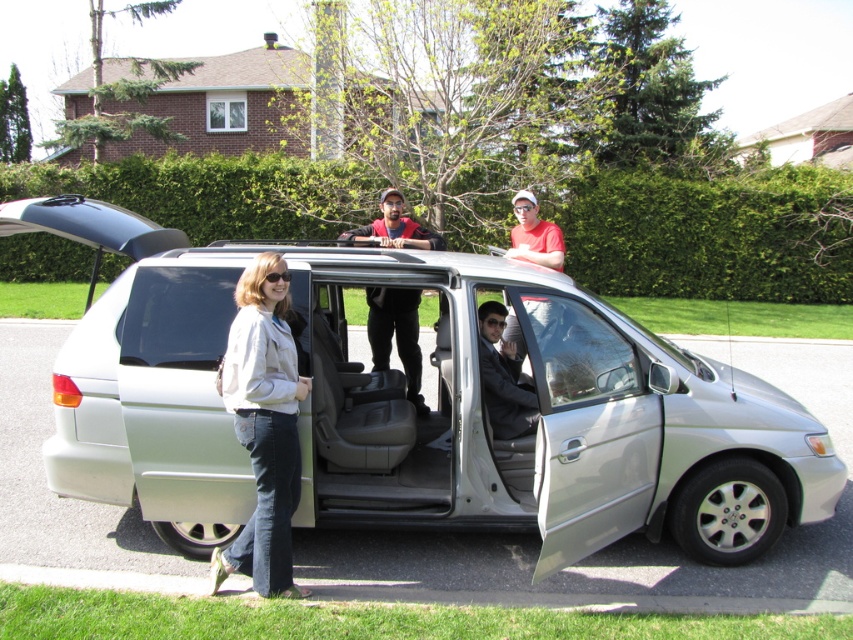
Question: Estimate the real-world distances between objects in this image. Which object is farther from the silver metallic minivan at center?

Choices:
 (A) dark gray suit at center
 (B) denim jeans at lower left
 (C) matte red shirt at upper center

Answer: (C)

Question: Which point is closer to the camera taking this photo?

Choices:
 (A) (422, 227)
 (B) (482, 305)
 (C) (506, 252)
 (D) (267, 292)

Answer: (D)

Question: Considering the relative positions of denim jeans at lower left and dark gray fabric shirt at center in the image provided, where is denim jeans at lower left located with respect to dark gray fabric shirt at center?

Choices:
 (A) below
 (B) above

Answer: (A)

Question: From the image, what is the correct spatial relationship of silver metallic minivan at center in relation to matte red shirt at upper center?

Choices:
 (A) right
 (B) left

Answer: (B)

Question: Considering the real-world distances, which object is closest to the silver metallic minivan at center?

Choices:
 (A) dark gray suit at center
 (B) matte red shirt at upper center
 (C) dark gray fabric shirt at center
 (D) denim jeans at lower left

Answer: (A)

Question: Does dark gray fabric shirt at center appear over matte red shirt at upper center?

Choices:
 (A) no
 (B) yes

Answer: (A)